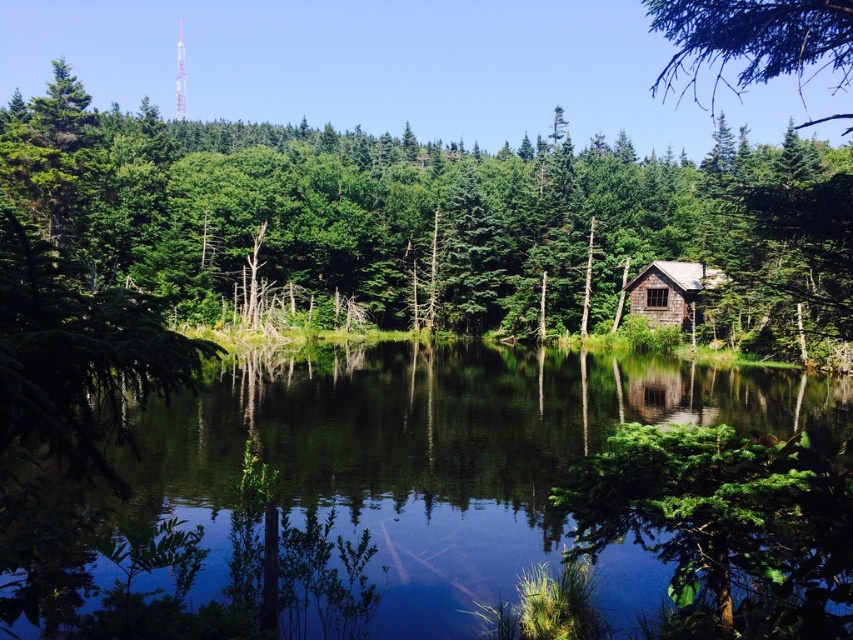
Question: Is the position of green matte tree at lower right more distant than that of green rough bark branch at upper right?

Choices:
 (A) yes
 (B) no

Answer: (B)

Question: Which object is positioned closest to the green matte tree at left?

Choices:
 (A) brown stone hut at center
 (B) green matte tree at lower right

Answer: (B)

Question: Does green matte tree at center lie in front of green matte tree at lower right?

Choices:
 (A) yes
 (B) no

Answer: (B)

Question: Which object appears closest to the camera in this image?

Choices:
 (A) green rough bark branch at upper right
 (B) green matte tree at lower right

Answer: (B)

Question: Can you confirm if green reflective water at center is positioned to the right of green rough bark branch at upper right?

Choices:
 (A) yes
 (B) no

Answer: (B)

Question: Among these points, which one is farthest from the camera?

Choices:
 (A) (12, 248)
 (B) (450, 616)
 (C) (15, 92)
 (D) (695, 99)

Answer: (D)